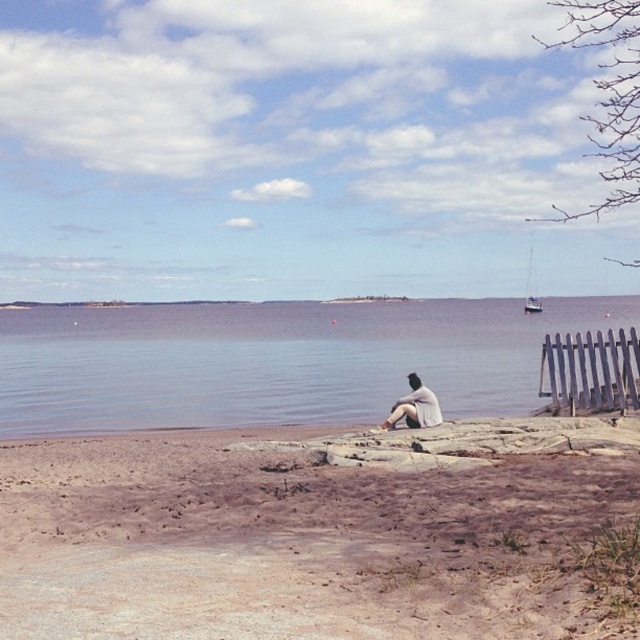
You are standing at the lakeside and want to walk from the gray wooden fence at lower right to the white cotton shirt at lower center. Which direction should you move relative to the fence?

To reach the white cotton shirt at lower center from the gray wooden fence at lower right, you should move towards the center and closer to the viewer since the gray wooden fence at lower right is further away than the white cotton shirt at lower center.

You are standing at the edge of the brown sandy beach at lower center and want to reach the white glossy sailboat at right. Which direction should you move to get closer to the sailboat?

Since the brown sandy beach at lower center is shorter than the white glossy sailboat at right, you should move towards the right direction to get closer to the sailboat.

You are standing at the brown sandy beach at lower center and want to reach the white glossy sailboat at right. Which direction should you move to get closer to the sailboat?

Since the brown sandy beach at lower center is in front of the white glossy sailboat at right, you should move backward away from the beach towards the direction of the sailboat to reach it.